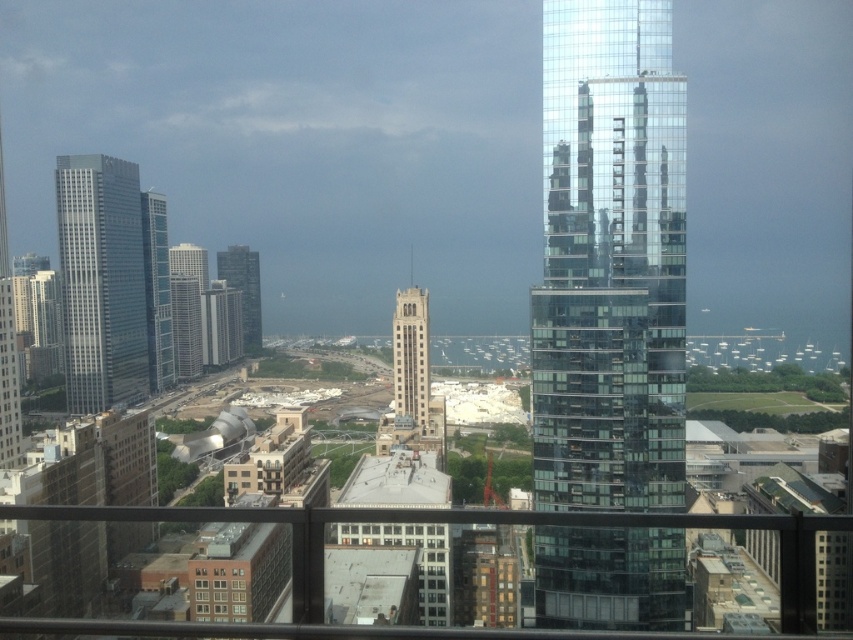
Question: Does transparent glass skyscraper at center appear on the left side of glassy steel skyscraper at left?

Choices:
 (A) no
 (B) yes

Answer: (A)

Question: Which point is closer to the camera taking this photo?

Choices:
 (A) (201, 572)
 (B) (183, 372)
 (C) (137, 300)

Answer: (A)

Question: Is transparent glass skyscraper at center positioned behind glassy reflective skyscraper at center?

Choices:
 (A) yes
 (B) no

Answer: (B)

Question: Which of these objects is positioned farthest from the matte glass skyscraper at center-left?

Choices:
 (A) transparent glass skyscraper at center
 (B) glassy steel skyscraper at left

Answer: (A)

Question: Which point appears farthest from the camera in this image?

Choices:
 (A) (135, 371)
 (B) (216, 593)
 (C) (172, 250)

Answer: (C)

Question: Can you confirm if brown brick building at lower left is bigger than matte glass skyscraper at center-left?

Choices:
 (A) no
 (B) yes

Answer: (A)